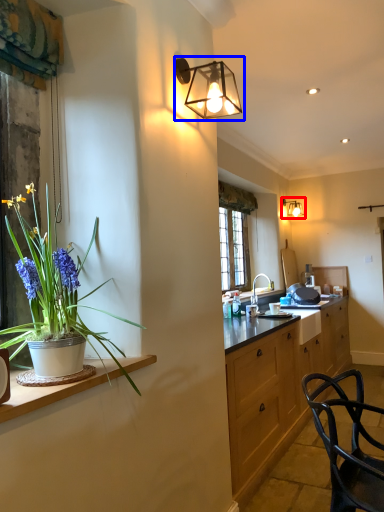
Question: Which of the following is the closest to the observer, lamp (highlighted by a red box) or lamp (highlighted by a blue box)?

Choices:
 (A) lamp
 (B) lamp

Answer: (B)